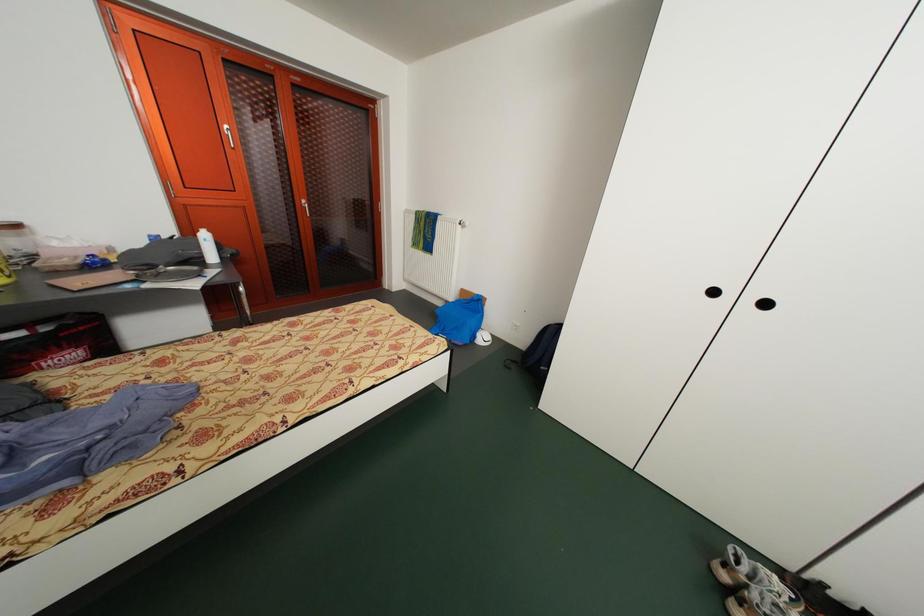
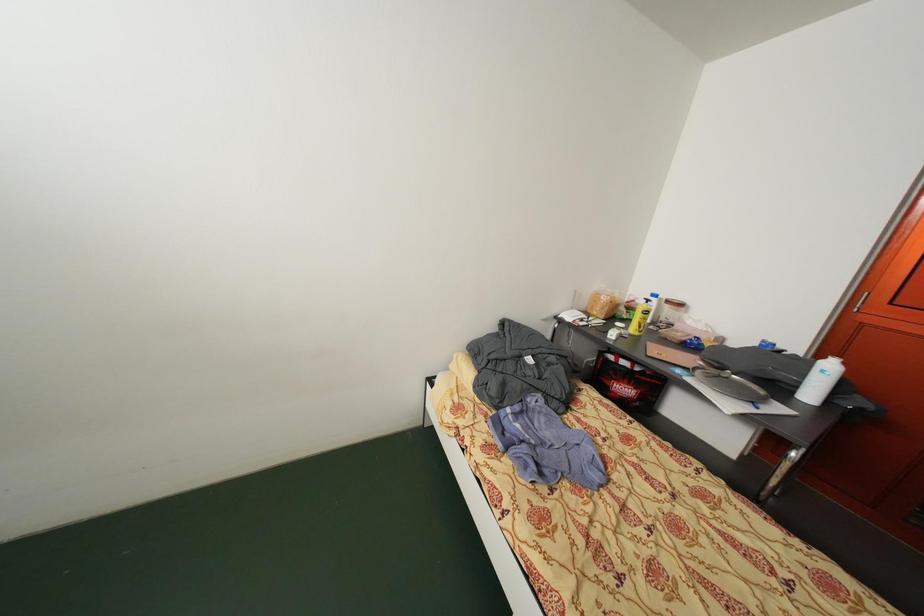
Based on the continuous images, in which direction is the camera rotating?

The camera rotated toward left-down.